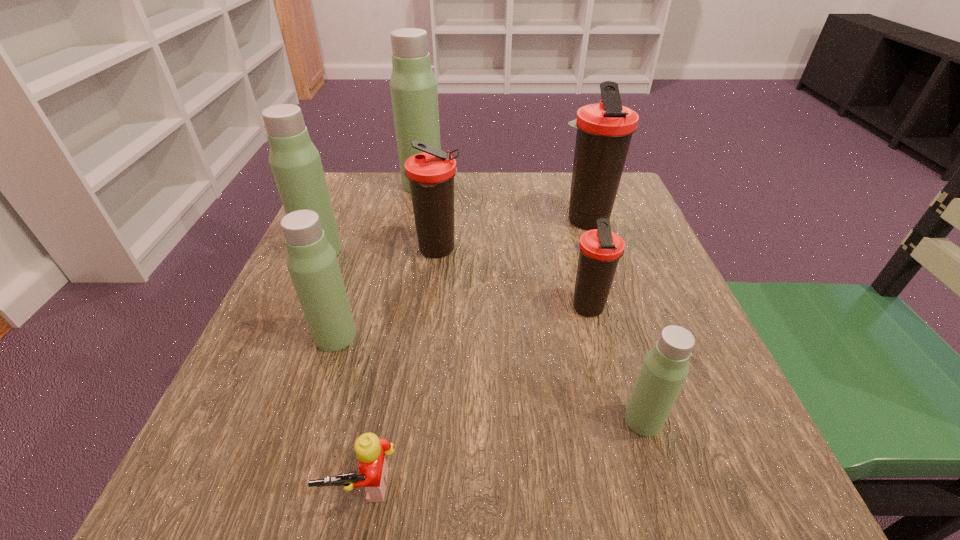
Locate an element on the screen. The image size is (960, 540). the smallest brown thermos bottle is located at coordinates (600, 249).

The height and width of the screenshot is (540, 960). I want to click on Lego, so click(370, 450).

Locate an element on the screen. The image size is (960, 540). the shortest object is located at coordinates (370, 450).

Image resolution: width=960 pixels, height=540 pixels. I want to click on vacant area situated 0.380m on the right of the farthest object, so click(x=588, y=184).

This screenshot has height=540, width=960. I want to click on vacant region located 0.220m on the front of the biggest brown thermos bottle, so click(613, 307).

Identify the location of vacant space situated on the front of the leftmost light thermos bottle. The height and width of the screenshot is (540, 960). (253, 402).

Find the location of a particular element. vacant space located on the front of the leftmost brown thermos bottle is located at coordinates (422, 381).

Locate an element on the screen. The image size is (960, 540). vacant area situated 0.150m on the back of the second light thermos bottle from left to right is located at coordinates (358, 267).

At what (x,y) coordinates should I click in order to perform the action: click on vacant space located 0.340m on the left of the seventh farthest object. Please return your answer as a coordinate pair (x, y). The image size is (960, 540). Looking at the image, I should click on (390, 420).

Find the location of a particular element. This screenshot has width=960, height=540. vacant region located 0.160m on the back of the smallest brown thermos bottle is located at coordinates (569, 243).